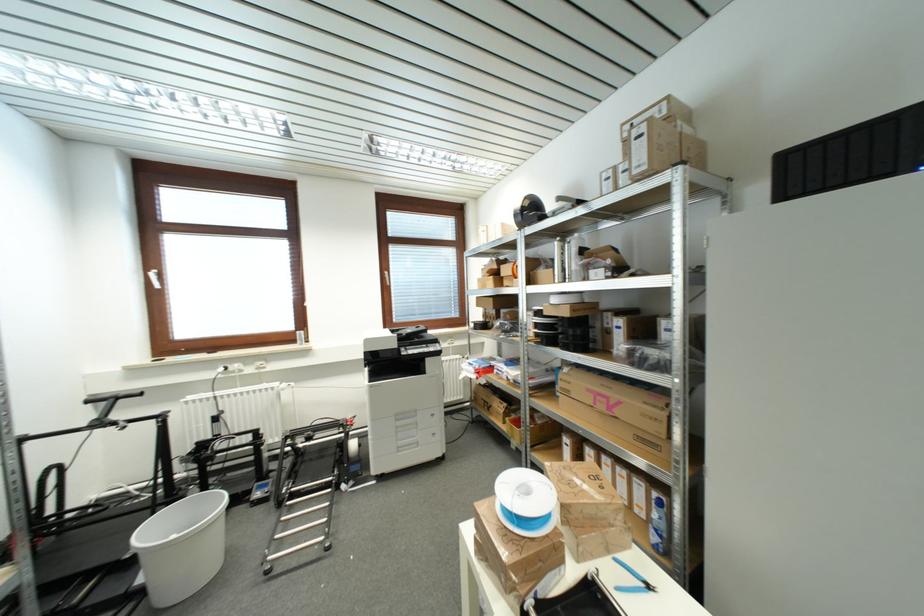
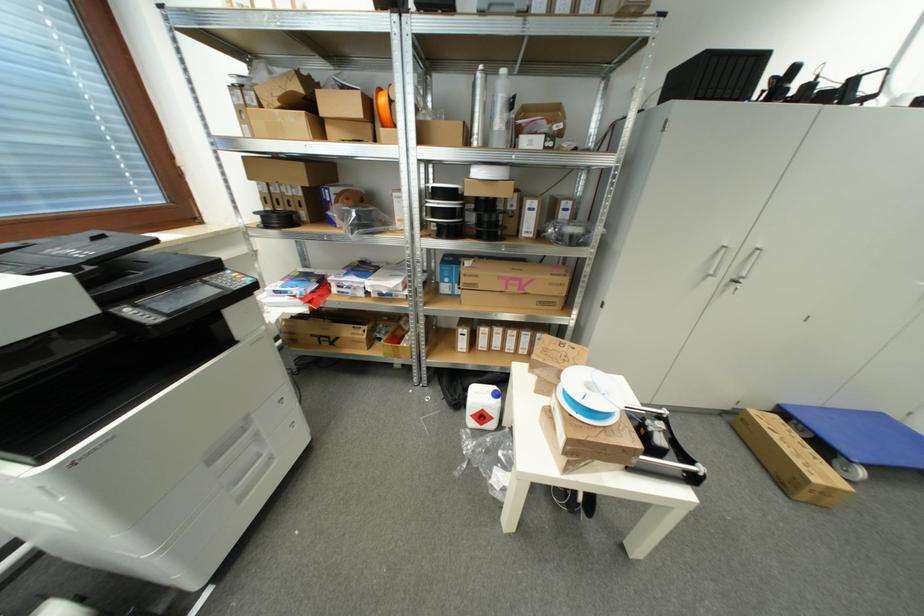
Locate, in the second image, the point that corresponds to point 578,339 in the first image.

(493, 225)